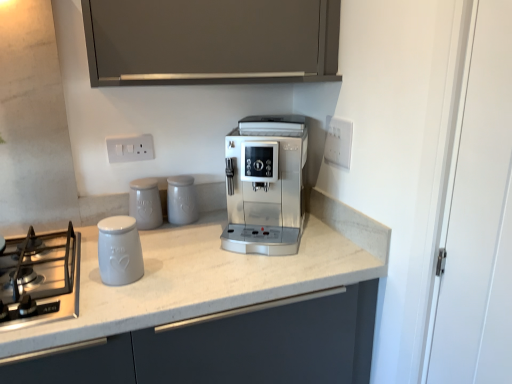
Image resolution: width=512 pixels, height=384 pixels. Find the location of `free space above satin silver coffee maker at center (from a real-world perspective)`. free space above satin silver coffee maker at center (from a real-world perspective) is located at coordinates (263, 123).